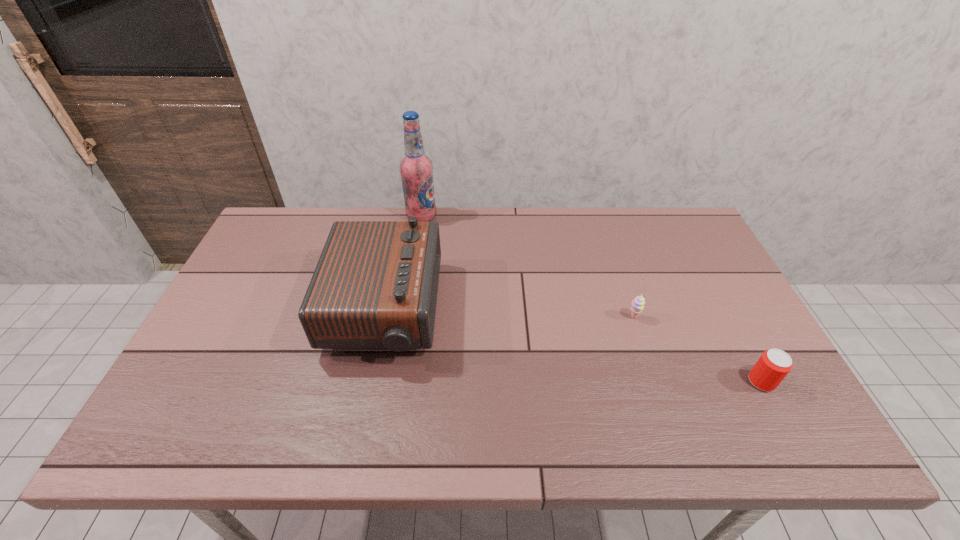
The image size is (960, 540). Identify the location of object positioned at the far edge. (416, 169).

The height and width of the screenshot is (540, 960). Find the location of `object located at the right edge`. object located at the right edge is located at coordinates (772, 367).

Find the location of a particular element. The height and width of the screenshot is (540, 960). free space at the far edge is located at coordinates (528, 234).

Where is `vacant space at the near edge`? vacant space at the near edge is located at coordinates (382, 423).

The width and height of the screenshot is (960, 540). I want to click on vacant point at the left edge, so click(248, 373).

Locate an element on the screen. vacant position at the right edge of the desktop is located at coordinates (729, 300).

The image size is (960, 540). Identify the location of free space at the far left corner of the desktop. (274, 215).

This screenshot has width=960, height=540. Identify the location of vacant space that is in between the sherbert and the rightmost object. (697, 349).

Locate an element on the screen. The image size is (960, 540). free area in between the tallest object and the third object from left to right is located at coordinates (527, 267).

I want to click on free space between the tallest object and the nearest object, so click(x=591, y=299).